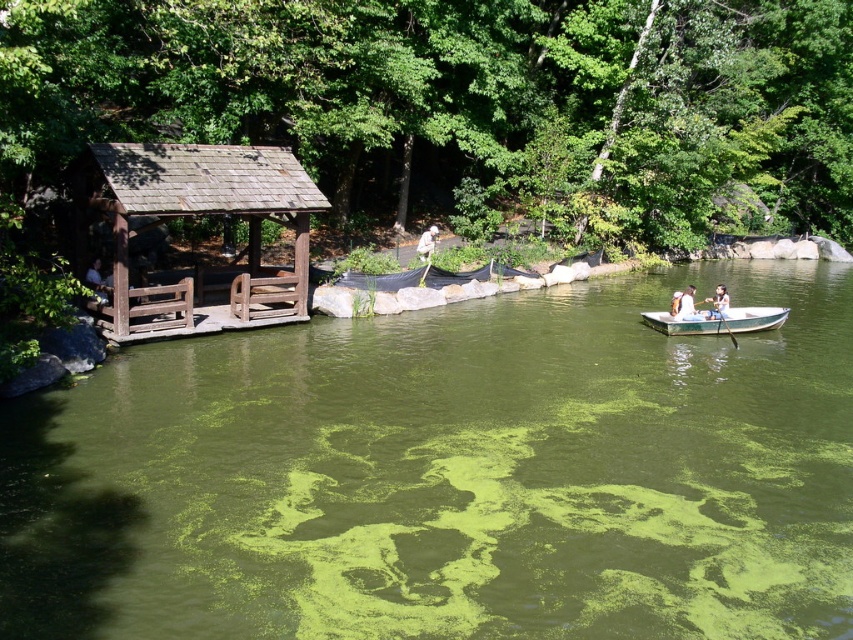
You are a visitor at the park and want to take a photo of the brown wooden gazebo at left and the white fur dog at center. Which object should you focus on first if you want to capture both in the same frame without moving the camera?

The brown wooden gazebo at left is not as tall as the white fur dog at center, so you should focus on the white fur dog at center first to ensure both are in frame.